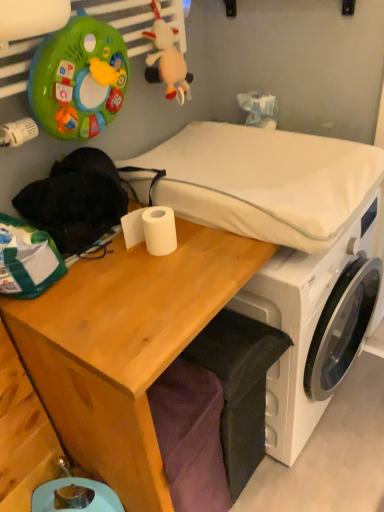
You are a GUI agent. You are given a task and a screenshot of the screen. Output one action in this format:
    pyautogui.click(x=<x>, y=<y>)
    Task: Click on the vacant space to the right of white matte toilet paper at center
    The width and height of the screenshot is (384, 512).
    Given the screenshot: What is the action you would take?
    pyautogui.click(x=213, y=249)